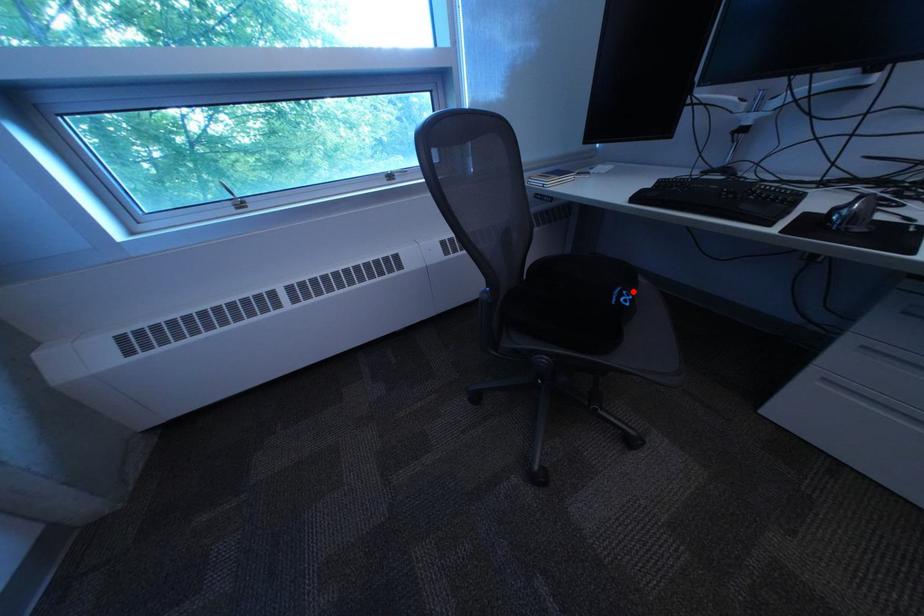
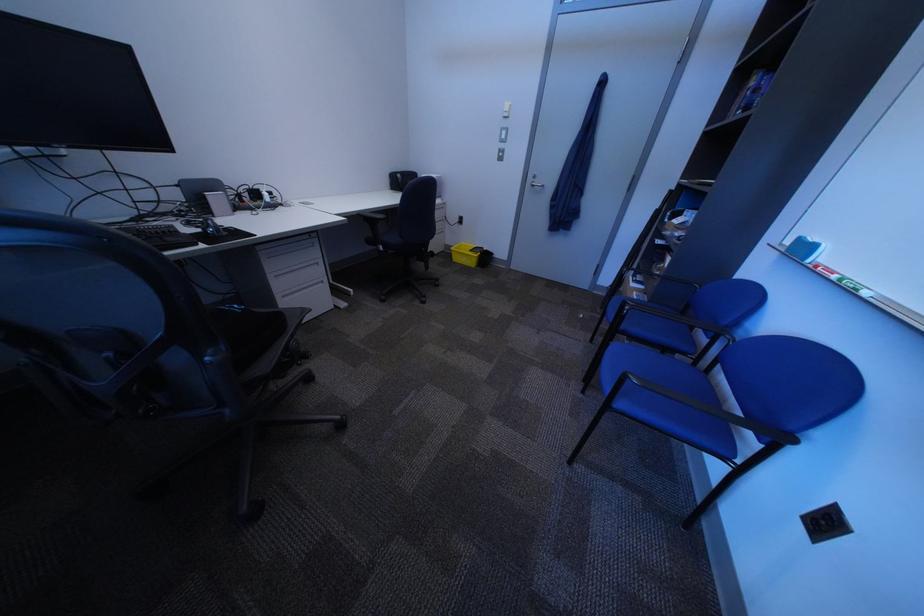
Where in the second image is the point corresponding to the highlighted location from the first image?

(238, 310)